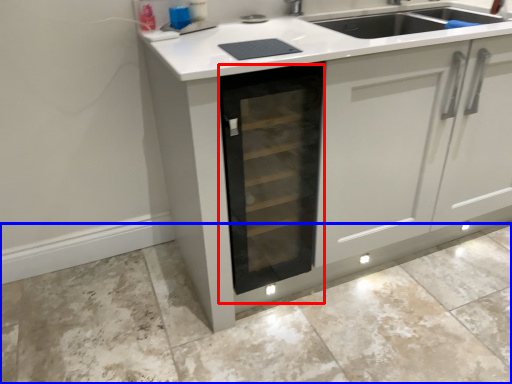
Question: Among these objects, which one is farthest to the camera, oven (highlighted by a red box) or granite (highlighted by a blue box)?

Choices:
 (A) oven
 (B) granite

Answer: (A)